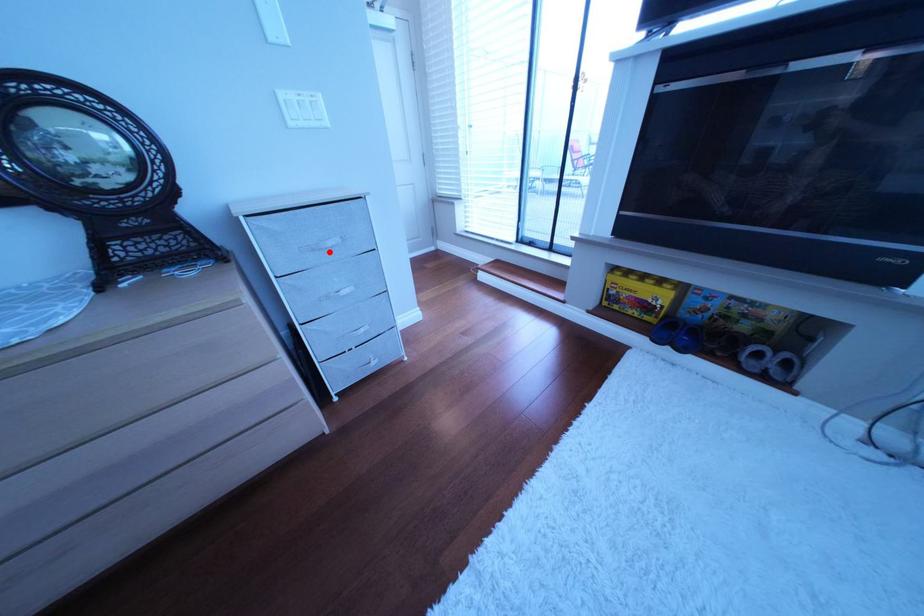
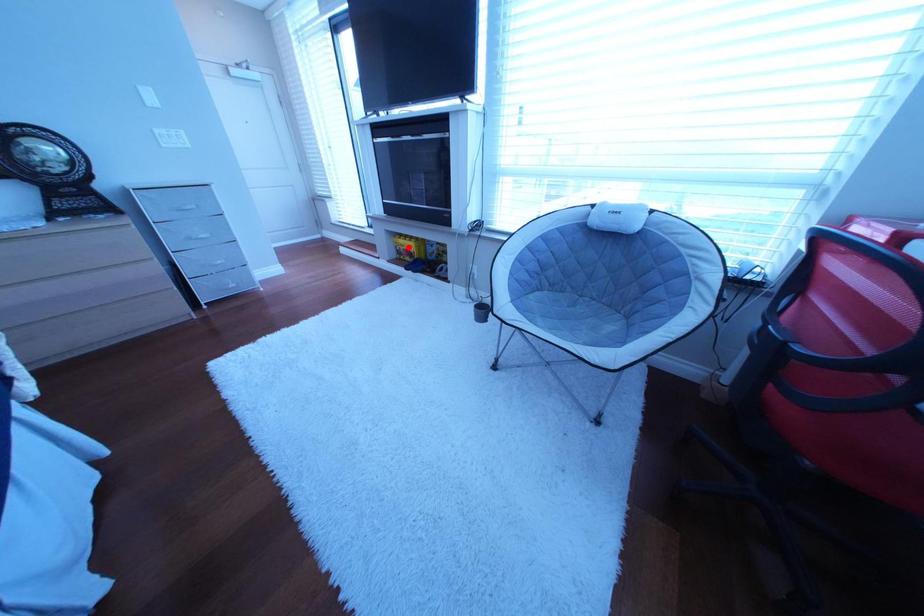
I am providing you with two images of the same scene from different viewpoints. A red point is marked on the first image and another point is marked on the second image. Is the red point in image1 aligned with the point shown in image2?

No